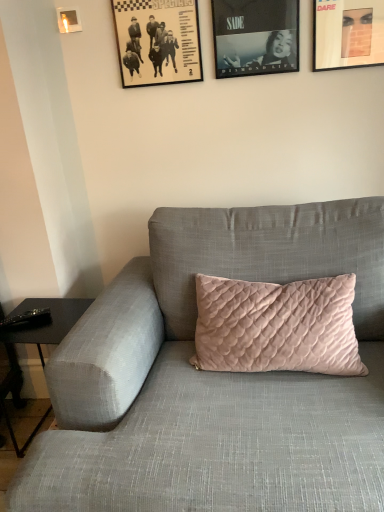
Question: From a real-world perspective, is matte black picture frame at upper center, which is the 2th picture frame in right-to-left order, physically above velvet pink pillow at center?

Choices:
 (A) no
 (B) yes

Answer: (B)

Question: Considering the relative sizes of matte black picture frame at upper center, marked as the 3th picture frame in a left-to-right arrangement, and velvet pink pillow at center in the image provided, is matte black picture frame at upper center, marked as the 3th picture frame in a left-to-right arrangement, shorter than velvet pink pillow at center?

Choices:
 (A) yes
 (B) no

Answer: (A)

Question: From a real-world perspective, does matte black picture frame at upper center, which is the 2th picture frame in right-to-left order, sit lower than velvet pink pillow at center?

Choices:
 (A) no
 (B) yes

Answer: (A)

Question: Is velvet pink pillow at center at the back of matte black picture frame at upper center, marked as the 3th picture frame in a left-to-right arrangement?

Choices:
 (A) yes
 (B) no

Answer: (B)

Question: Does matte black picture frame at upper center, marked as the 3th picture frame in a left-to-right arrangement, have a larger size compared to velvet pink pillow at center?

Choices:
 (A) yes
 (B) no

Answer: (B)

Question: From a real-world perspective, is metallic gold picture frame at upper left, which ranks as the first picture frame in left-to-right order, above or below black paper picture frame at upper center, arranged as the 3th picture frame when viewed from the right?

Choices:
 (A) below
 (B) above

Answer: (B)

Question: Does point (66, 12) appear closer or farther from the camera than point (135, 59)?

Choices:
 (A) farther
 (B) closer

Answer: (B)

Question: In the image, is metallic gold picture frame at upper left, the fourth picture frame viewed from the right, on the left side or the right side of black paper picture frame at upper center, the 2th picture frame in the left-to-right sequence?

Choices:
 (A) right
 (B) left

Answer: (B)

Question: From their relative heights in the image, would you say metallic gold picture frame at upper left, the fourth picture frame viewed from the right, is taller or shorter than black paper picture frame at upper center, the 2th picture frame in the left-to-right sequence?

Choices:
 (A) tall
 (B) short

Answer: (B)

Question: Which is correct: velvet pink pillow at center is inside matte black picture frame at upper center, which is the 2th picture frame in right-to-left order, or outside of it?

Choices:
 (A) inside
 (B) outside

Answer: (B)

Question: From a real-world perspective, is velvet pink pillow at center above or below matte black picture frame at upper center, which is the 2th picture frame in right-to-left order?

Choices:
 (A) below
 (B) above

Answer: (A)

Question: Considering the positions of velvet pink pillow at center and matte black picture frame at upper center, which is the 2th picture frame in right-to-left order, in the image, is velvet pink pillow at center wider or thinner than matte black picture frame at upper center, which is the 2th picture frame in right-to-left order,?

Choices:
 (A) wide
 (B) thin

Answer: (A)

Question: From the image's perspective, is velvet pink pillow at center located above or below matte black picture frame at upper center, which is the 2th picture frame in right-to-left order?

Choices:
 (A) below
 (B) above

Answer: (A)

Question: Would you say metallic gold picture frame at upper left, the fourth picture frame viewed from the right, is to the left or to the right of velvet pink pillow at center in the picture?

Choices:
 (A) right
 (B) left

Answer: (B)

Question: Relative to velvet pink pillow at center, is metallic gold picture frame at upper left, which ranks as the first picture frame in left-to-right order, in front or behind?

Choices:
 (A) behind
 (B) front

Answer: (A)